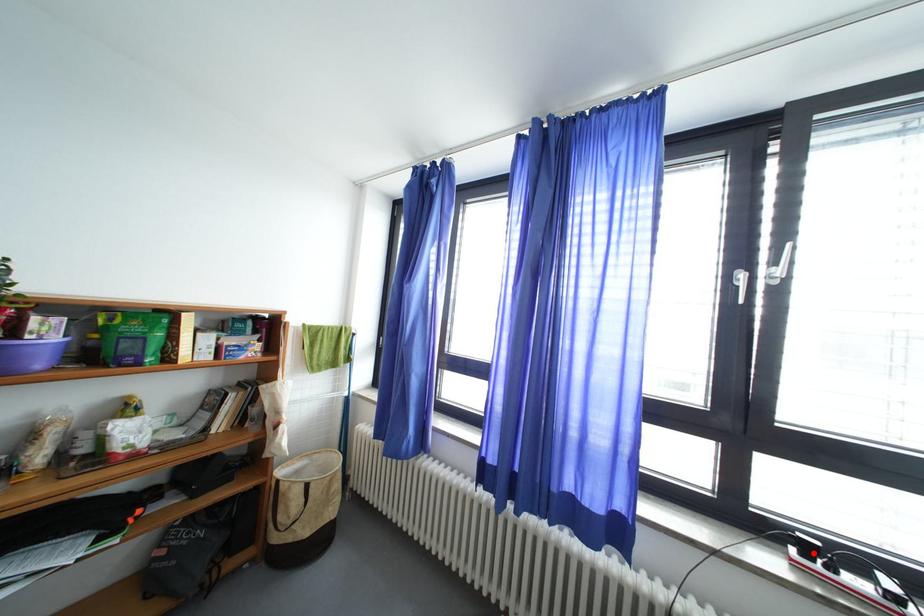
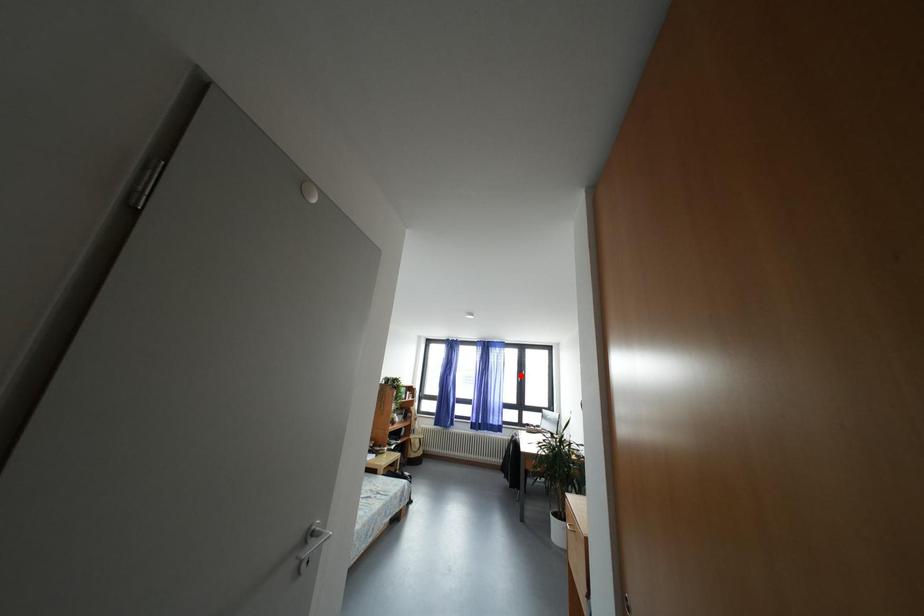
I am providing you with two images of the same scene from different viewpoints. A red point is marked on the first image and another point is marked on the second image. Are the points marked in image1 and image2 representing the same 3D position?

No